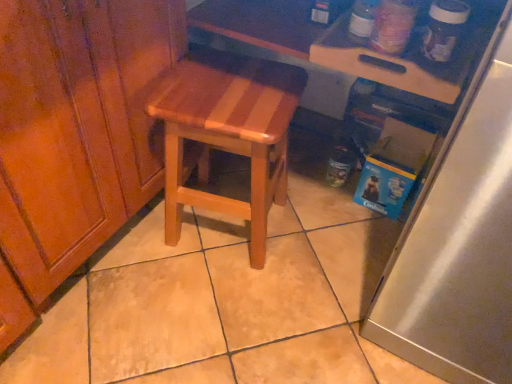
Locate an element on the screen. The width and height of the screenshot is (512, 384). free space to the left of wooden at center is located at coordinates (130, 248).